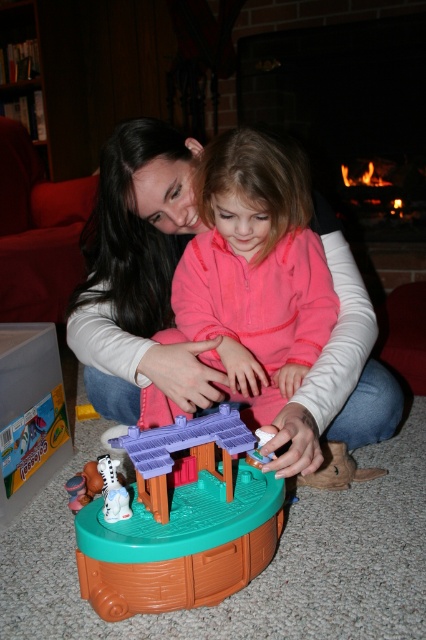
Who is shorter, brown plastic playset at center or white matte plush toy at lower left?

Standing shorter between the two is white matte plush toy at lower left.

Is brown plastic playset at center positioned at the back of white matte plush toy at lower left?

No, it is not.

You are a GUI agent. You are given a task and a screenshot of the screen. Output one action in this format:
    pyautogui.click(x=<x>, y=<y>)
    Task: Click on the brown plastic playset at center
    This screenshot has height=640, width=426.
    Given the screenshot: What is the action you would take?
    pyautogui.click(x=181, y=524)

Image resolution: width=426 pixels, height=640 pixels. In order to click on brown plastic playset at center in this screenshot , I will do `click(181, 524)`.

Between pink matte jacket at center and brick fireplace at upper center, which one is positioned higher?

brick fireplace at upper center is above.

Who is taller, pink matte jacket at center or brick fireplace at upper center?

With more height is brick fireplace at upper center.

I want to click on pink matte jacket at center, so pyautogui.click(x=256, y=269).

Can you confirm if brick fireplace at upper center is shorter than white matte plush toy at lower left?

Incorrect, brick fireplace at upper center's height does not fall short of white matte plush toy at lower left's.

In order to click on brick fireplace at upper center in this screenshot , I will do (348, 112).

Where is `brick fireplace at upper center`? The image size is (426, 640). brick fireplace at upper center is located at coordinates (348, 112).